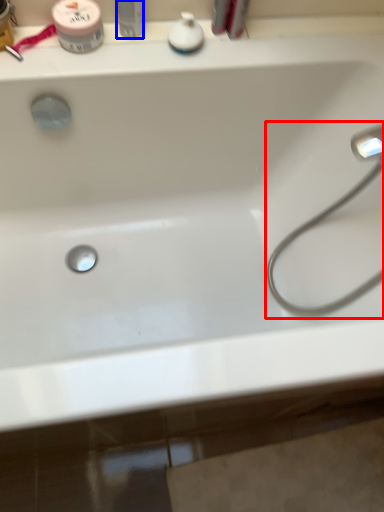
Question: Among these objects, which one is nearest to the camera, faucet (highlighted by a red box) or toiletry (highlighted by a blue box)?

Choices:
 (A) faucet
 (B) toiletry

Answer: (A)